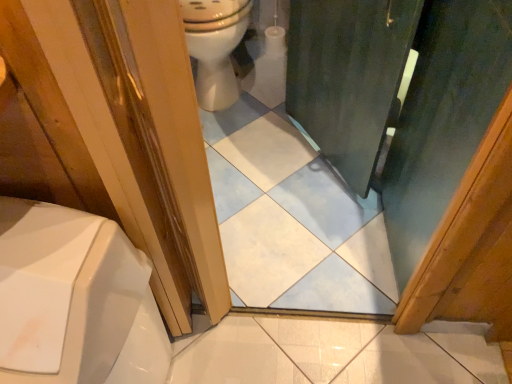
Question: Is green matte screen door at center located within white glossy toilet at upper center?

Choices:
 (A) no
 (B) yes

Answer: (A)

Question: From the image's perspective, would you say white glossy toilet at upper center is positioned over green matte screen door at center?

Choices:
 (A) no
 (B) yes

Answer: (B)

Question: Can you confirm if white glossy toilet at upper center is thinner than green matte screen door at center?

Choices:
 (A) no
 (B) yes

Answer: (A)

Question: Is white glossy toilet at upper center oriented away from green matte screen door at center?

Choices:
 (A) no
 (B) yes

Answer: (A)

Question: Is white glossy toilet at upper center taller than green matte screen door at center?

Choices:
 (A) yes
 (B) no

Answer: (B)

Question: Is white glossy toilet at upper center far from green matte screen door at center?

Choices:
 (A) no
 (B) yes

Answer: (A)

Question: Could white glossy toilet at upper center be considered to be inside green matte screen door at center?

Choices:
 (A) yes
 (B) no

Answer: (B)

Question: From a real-world perspective, is green matte screen door at center physically above white glossy toilet at upper center?

Choices:
 (A) no
 (B) yes

Answer: (B)

Question: Does green matte screen door at center turn towards white glossy toilet at upper center?

Choices:
 (A) no
 (B) yes

Answer: (B)

Question: Does green matte screen door at center come behind white glossy toilet at upper center?

Choices:
 (A) yes
 (B) no

Answer: (B)

Question: Does green matte screen door at center have a larger size compared to white glossy toilet at upper center?

Choices:
 (A) yes
 (B) no

Answer: (A)

Question: From a real-world perspective, is green matte screen door at center physically below white glossy toilet at upper center?

Choices:
 (A) yes
 (B) no

Answer: (B)

Question: Which is correct: green matte screen door at center is inside white glossy toilet at upper center, or outside of it?

Choices:
 (A) outside
 (B) inside

Answer: (A)